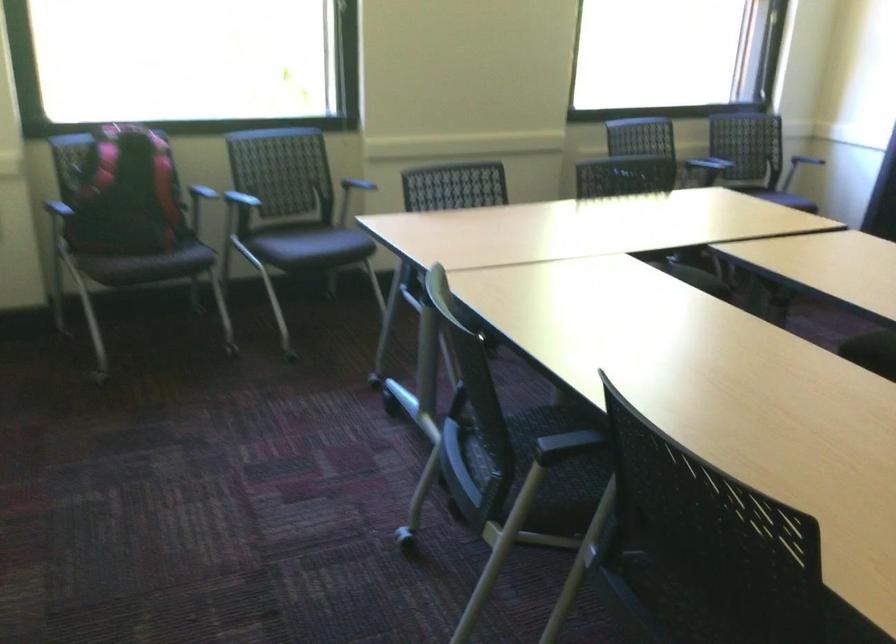
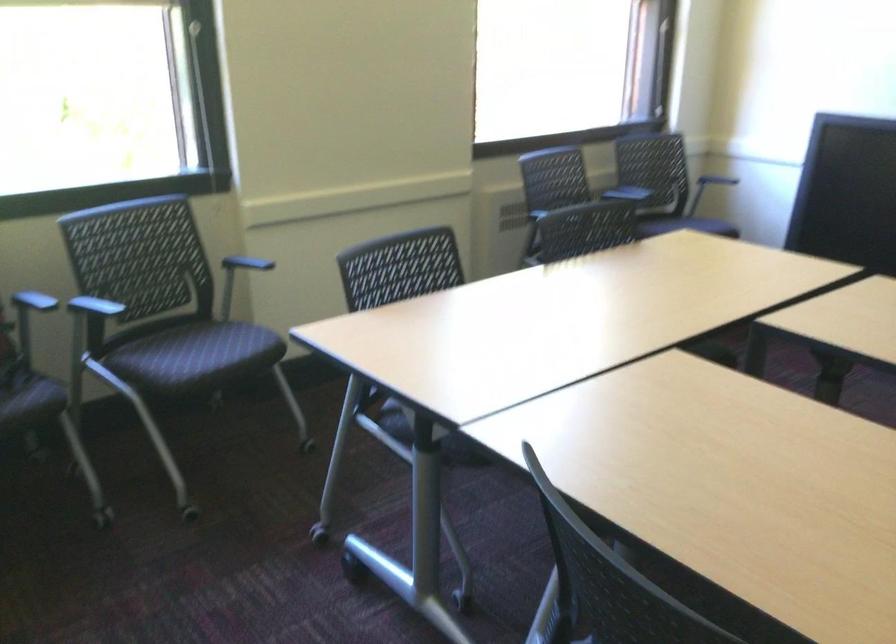
Question: The first image is from the beginning of the video and the second image is from the end. How did the camera likely rotate when shooting the video?

Choices:
 (A) Left
 (B) Right
 (C) Up
 (D) Down

Answer: (B)